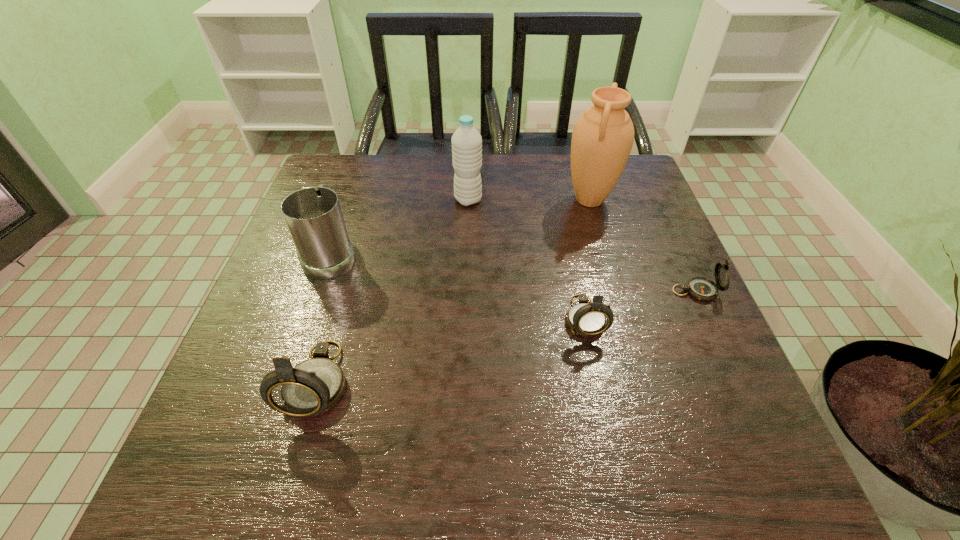
To achieve uniform spacing by inserting another compass among them, please point to a free space for this new compass. Please provide its 2D coordinates. Your answer should be formatted as a tuple, i.e. [(x, y)], where the tuple contains the x and y coordinates of a point satisfying the conditions above.

[(459, 347)]